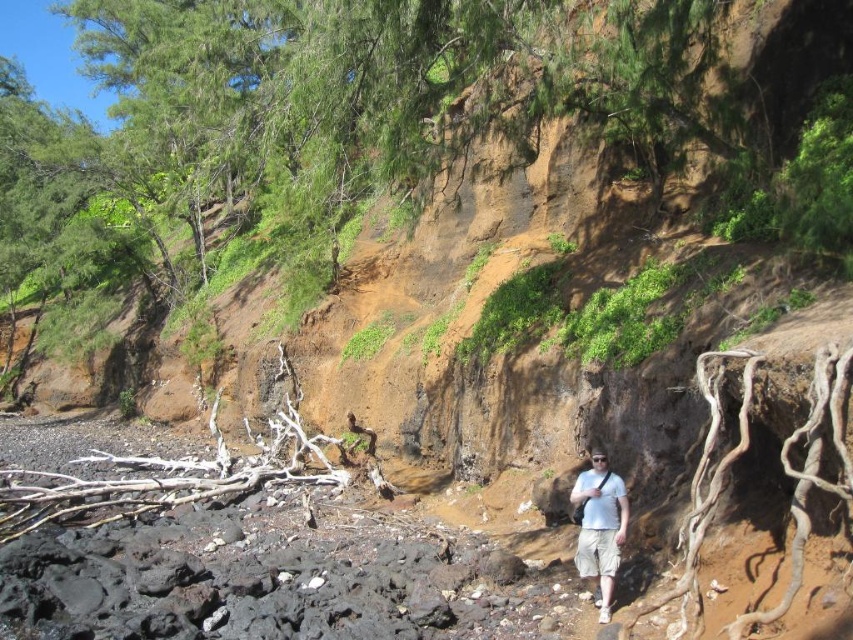
Question: Can you confirm if brown rough tree root at lower left is wider than white cotton shirt at lower right?

Choices:
 (A) no
 (B) yes

Answer: (B)

Question: Does brown rough tree root at lower left come in front of white cotton shirt at lower right?

Choices:
 (A) yes
 (B) no

Answer: (B)

Question: Which point is farther to the camera?

Choices:
 (A) white cotton shirt at lower right
 (B) brown rough tree root at lower left

Answer: (B)

Question: Can you confirm if brown rough tree root at lower left is positioned to the right of white cotton shirt at lower right?

Choices:
 (A) no
 (B) yes

Answer: (A)